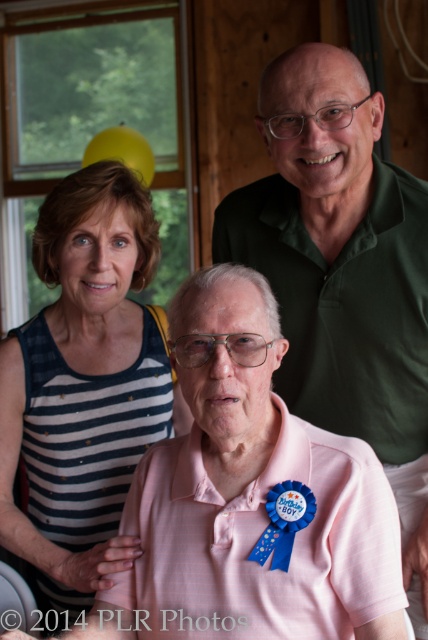
Does green matte shirt at upper center come in front of striped fabric dress at upper left?

That is False.

Is point (353, 218) farther from camera compared to point (32, 332)?

No, it is not.

Is point (269, 189) less distant than point (133, 460)?

No, (269, 189) is behind (133, 460).

Where is `green matte shirt at upper center`? green matte shirt at upper center is located at coordinates (342, 273).